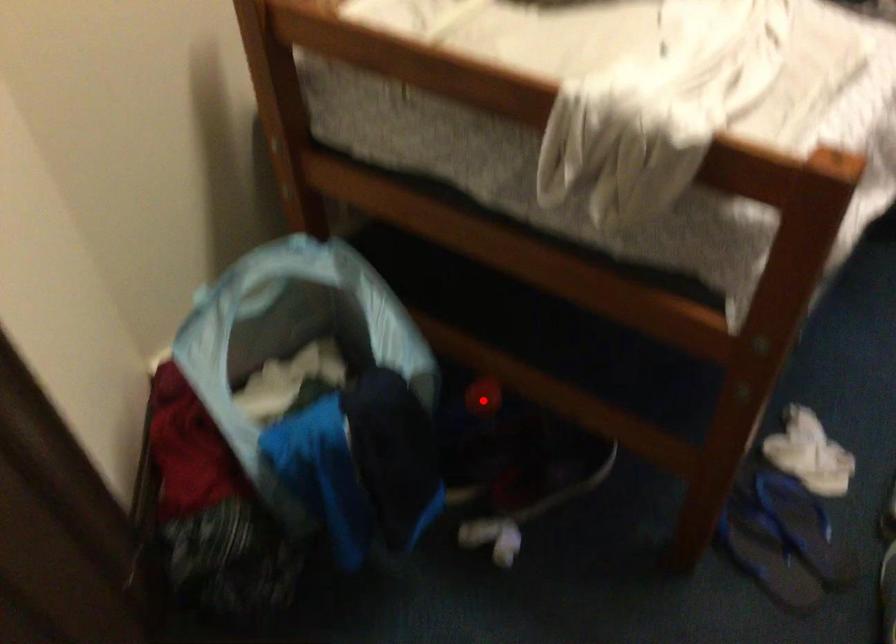
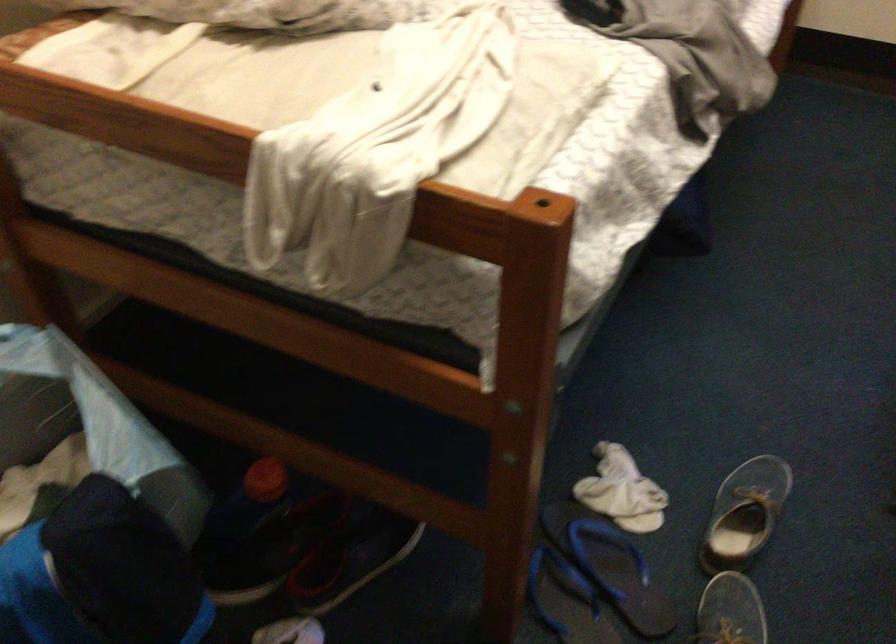
Find the pixel in the second image that matches the highlighted location in the first image.

(264, 480)